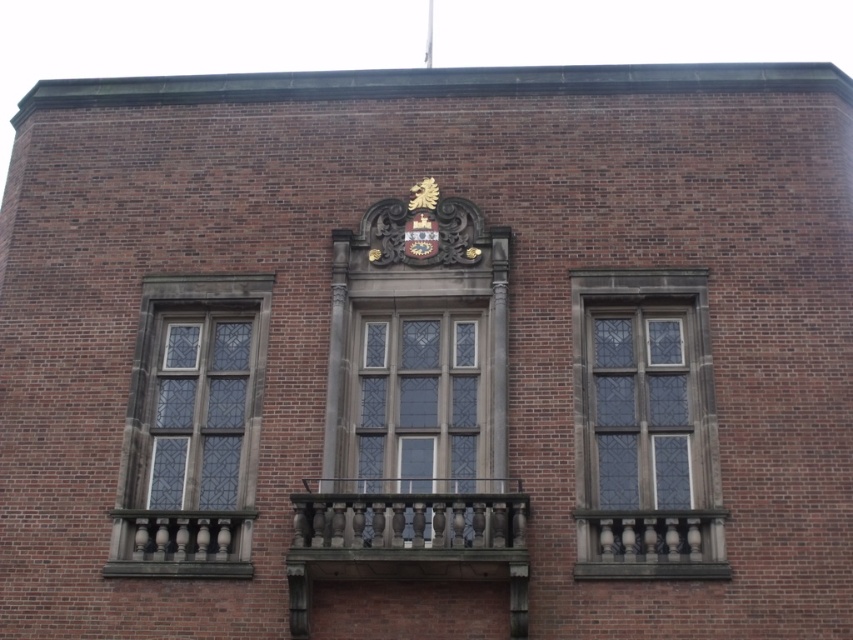
Question: Observing the image, what is the correct spatial positioning of clear glass window at left in reference to stone balustrade at center?

Choices:
 (A) right
 (B) left

Answer: (B)

Question: Which object is closer to the camera taking this photo?

Choices:
 (A) stone balustrade at center
 (B) clear glass window at center
 (C) stained glass window at center
 (D) brown polished wood balcony at center

Answer: (D)

Question: Among these points, which one is nearest to the camera?

Choices:
 (A) (370, 378)
 (B) (590, 294)
 (C) (393, 522)

Answer: (C)

Question: Which object is positioned closest to the stained glass window at center?

Choices:
 (A) brown polished wood balcony at center
 (B) stone balustrade at center
 (C) clear glass window at left
 (D) clear glass window at center

Answer: (D)

Question: Where is stained glass window at center located in relation to polished stone balcony at center in the image?

Choices:
 (A) left
 (B) right

Answer: (B)

Question: Is stained glass window at center positioned before clear glass window at center?

Choices:
 (A) yes
 (B) no

Answer: (B)